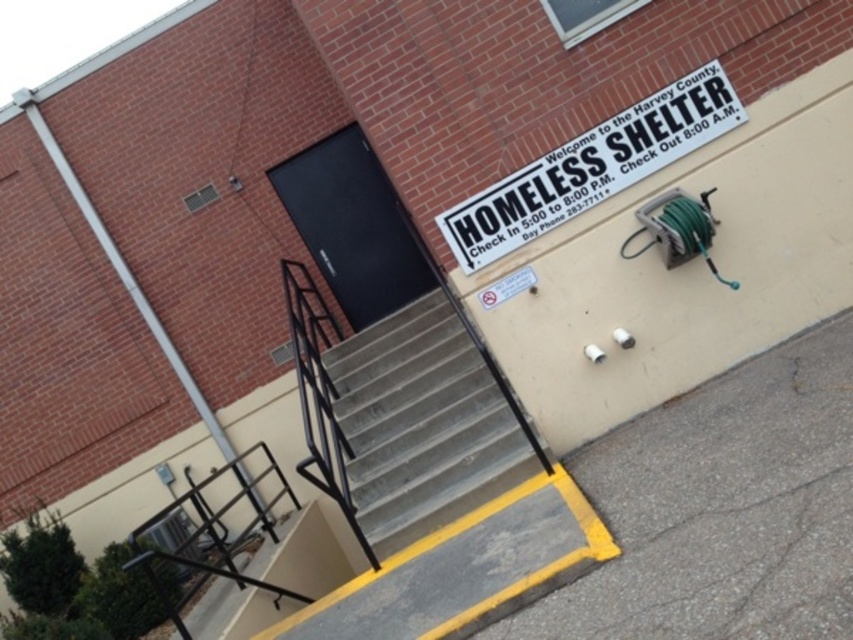
You are standing at the bottom of the concrete stairs at center and want to reach the white plastic sign at upper center. Which direction should you move to get closer to the sign?

Since the concrete stairs at center is closer to the viewer than the white plastic sign at upper center, you should move upwards along the concrete stairs at center to approach the white plastic sign at upper center.

You are standing at the entrance of the homeless shelter. There is a point marked at coordinates (590, 168). Where is this point located in relation to the white plastic sign at upper center?

The point (590, 168) is located on the white plastic sign at upper center.